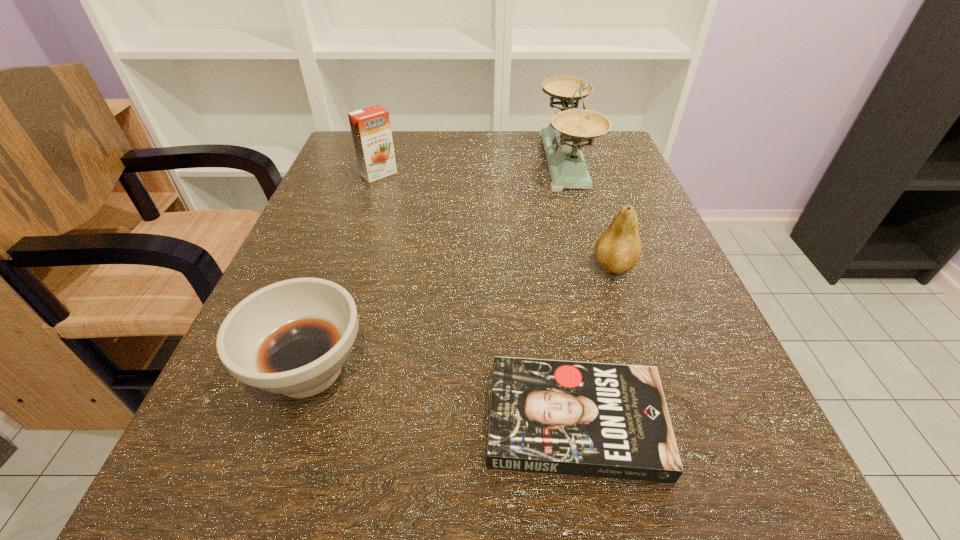
Locate an element on the screen. vacant position in the image that satisfies the following two spatial constraints: 1. on the front-facing side of the pear; 2. on the left side of the scale is located at coordinates (595, 265).

The height and width of the screenshot is (540, 960). What are the coordinates of `vacant space that satisfies the following two spatial constraints: 1. on the back side of the second shortest object; 2. on the left side of the orange juice` in the screenshot? It's located at (375, 174).

Where is `vacant space that satisfies the following two spatial constraints: 1. on the front-facing side of the third farthest object; 2. on the right side of the tallest object`? The width and height of the screenshot is (960, 540). vacant space that satisfies the following two spatial constraints: 1. on the front-facing side of the third farthest object; 2. on the right side of the tallest object is located at coordinates (595, 265).

I want to click on vacant point that satisfies the following two spatial constraints: 1. on the back side of the pear; 2. on the left side of the soup bowl, so click(x=344, y=265).

Identify the location of vacant region that satisfies the following two spatial constraints: 1. on the front-facing side of the tallest object; 2. on the right side of the third nearest object. (595, 265).

Find the location of `vacant space that satisfies the following two spatial constraints: 1. on the back side of the pear; 2. on the right side of the soup bowl`. vacant space that satisfies the following two spatial constraints: 1. on the back side of the pear; 2. on the right side of the soup bowl is located at coordinates (344, 265).